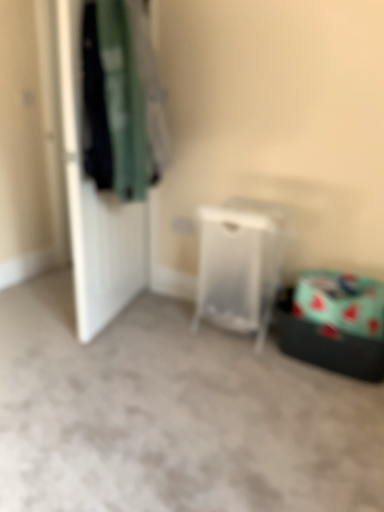
This screenshot has height=512, width=384. Identify the location of vacant space in dark green fabric at left (from a real-world perspective). (141, 318).